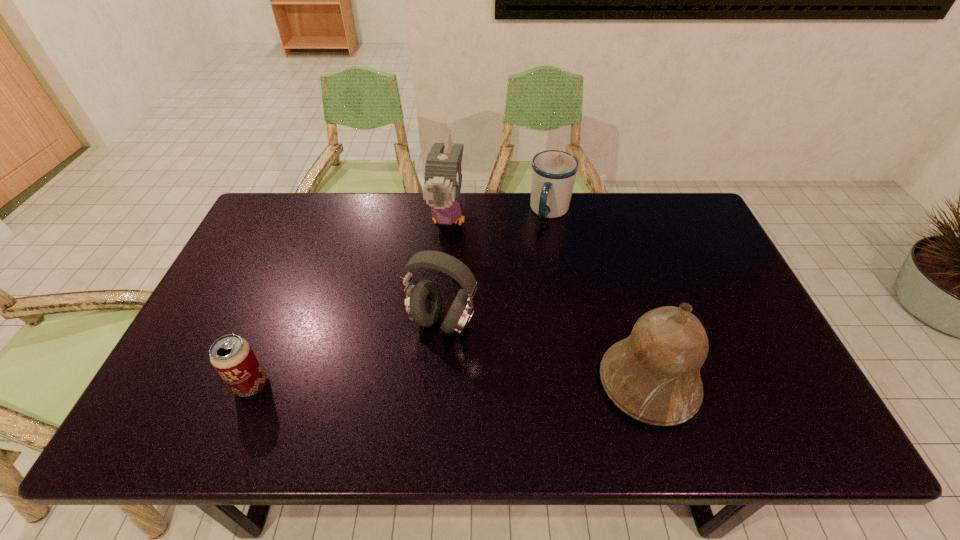
This screenshot has height=540, width=960. I want to click on vacant space located on the ear cups of the headset, so click(x=400, y=383).

Find the location of `vacant space located at the beak of the bird`. vacant space located at the beak of the bird is located at coordinates (429, 310).

Identify the location of free space located at the beak of the bird. The image size is (960, 540). (435, 286).

You are a GUI agent. You are given a task and a screenshot of the screen. Output one action in this format:
    pyautogui.click(x=<x>, y=<y>)
    Task: Click on the vacant space located at the beak of the bird
    
    Given the screenshot: What is the action you would take?
    pyautogui.click(x=433, y=294)

Locate an element on the screen. Image resolution: width=960 pixels, height=540 pixels. free region located on the handle side of the mug is located at coordinates (531, 289).

I want to click on blank space located on the handle side of the mug, so click(523, 318).

This screenshot has height=540, width=960. What are the coordinates of `vacant space located 0.370m on the handle side of the mug` in the screenshot? It's located at (523, 315).

Image resolution: width=960 pixels, height=540 pixels. What are the coordinates of `bird that is at the far edge` in the screenshot? It's located at (443, 178).

Locate an element on the screen. mug positioned at the far edge is located at coordinates (553, 172).

Where is `beer can positioned at the near edge`? beer can positioned at the near edge is located at coordinates (233, 358).